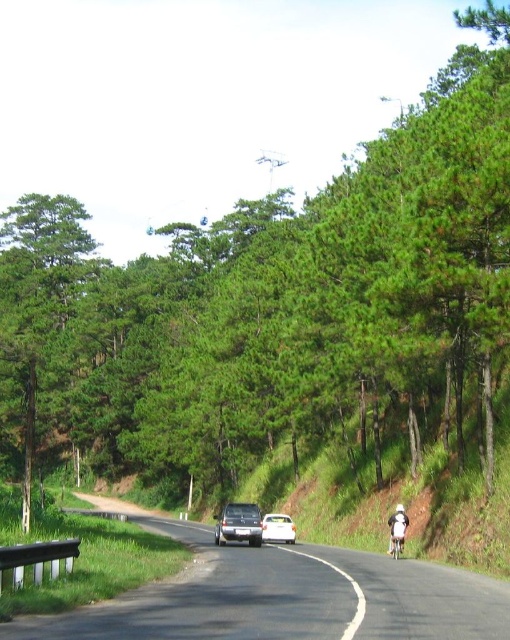
Can you confirm if black asphalt road at center is positioned above satin silver sedan at center?

Indeed, black asphalt road at center is positioned over satin silver sedan at center.

Is black asphalt road at center taller than satin silver sedan at center?

In fact, black asphalt road at center may be shorter than satin silver sedan at center.

Based on the photo, measure the distance between point (248, 564) and camera.

Point (248, 564) and camera are 19.29 meters apart.

This screenshot has height=640, width=510. Find the location of `black asphalt road at center`. black asphalt road at center is located at coordinates (286, 596).

Between point (230, 516) and point (391, 544), which one is positioned in front?

Point (391, 544) is more forward.

Can you confirm if satin silver sedan at center is positioned to the right of metallic silver bicycle at lower right?

No, satin silver sedan at center is not to the right of metallic silver bicycle at lower right.

Who is more distant from viewer, (248,515) or (392,554)?

Positioned behind is point (248,515).

You are a GUI agent. You are given a task and a screenshot of the screen. Output one action in this format:
    pyautogui.click(x=<x>, y=<y>)
    Task: Click on the satin silver sedan at center
    
    Given the screenshot: What is the action you would take?
    pyautogui.click(x=239, y=524)

Is green matte tree at left shorter than white glossy car at center?

No, green matte tree at left is not shorter than white glossy car at center.

Who is more forward, (13, 352) or (264, 528)?

Point (264, 528)

Between point (81, 252) and point (266, 540), which one is positioned behind?

Positioned behind is point (81, 252).

Image resolution: width=510 pixels, height=640 pixels. In order to click on green matte tree at left in this screenshot , I will do `click(37, 316)`.